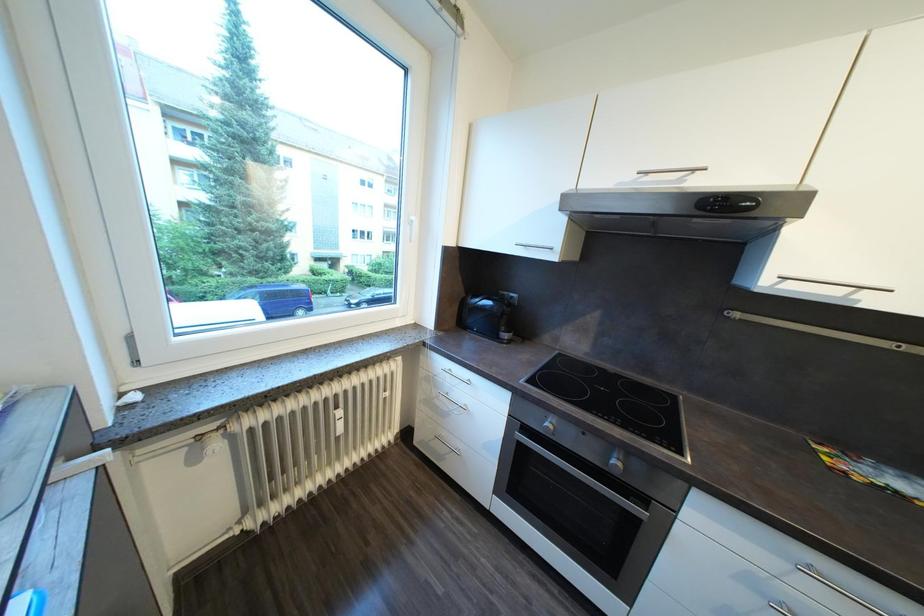
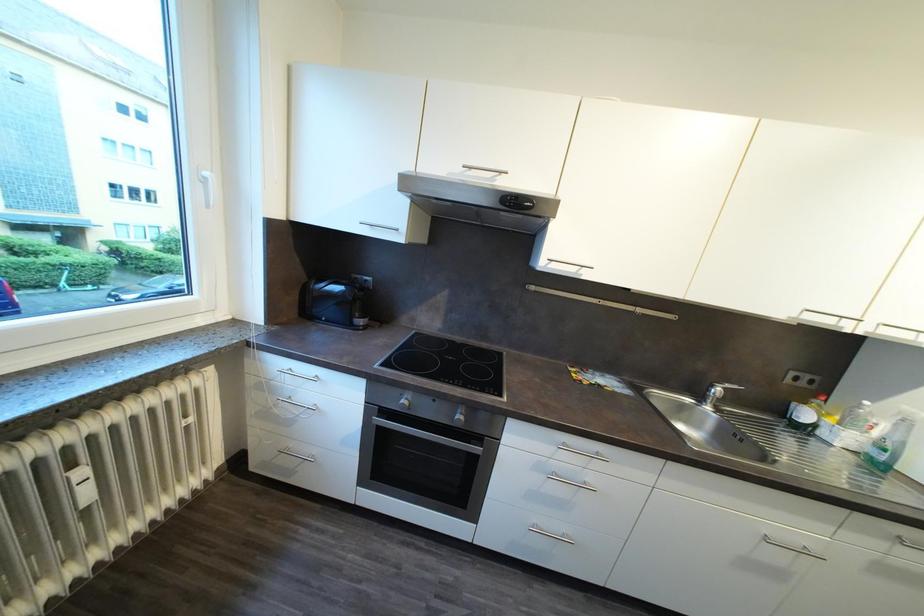
Question: The images are taken continuously from a first-person perspective. In which direction is your viewpoint rotating?

Choices:
 (A) Left
 (B) Right
 (C) Up
 (D) Down

Answer: (B)